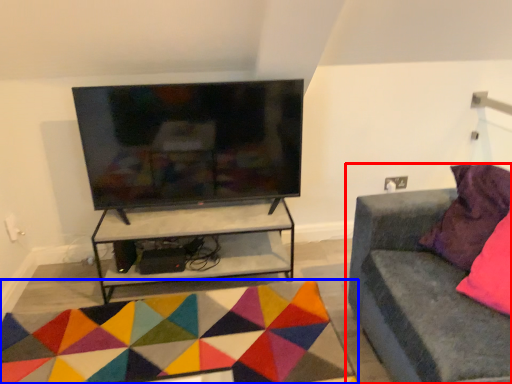
Question: Which object appears farthest to the camera in this image, studio couch (highlighted by a red box) or mat (highlighted by a blue box)?

Choices:
 (A) studio couch
 (B) mat

Answer: (B)